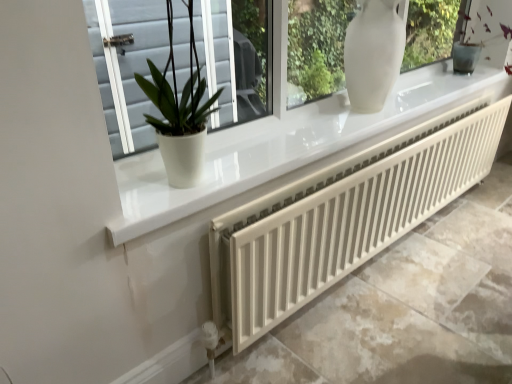
Question: Does white glossy pot at left have a lesser height compared to white matte radiator at lower center?

Choices:
 (A) yes
 (B) no

Answer: (A)

Question: Considering the relative sizes of white glossy pot at left and white matte radiator at lower center in the image provided, is white glossy pot at left thinner than white matte radiator at lower center?

Choices:
 (A) yes
 (B) no

Answer: (B)

Question: Does white glossy pot at left touch white matte radiator at lower center?

Choices:
 (A) no
 (B) yes

Answer: (A)

Question: From the image's perspective, is white glossy pot at left under white matte radiator at lower center?

Choices:
 (A) yes
 (B) no

Answer: (B)

Question: From a real-world perspective, is white glossy pot at left located beneath white matte radiator at lower center?

Choices:
 (A) no
 (B) yes

Answer: (A)

Question: Can you confirm if white glossy pot at left is smaller than white matte radiator at lower center?

Choices:
 (A) no
 (B) yes

Answer: (B)

Question: From the image's perspective, does white matte radiator at lower center appear higher than white glossy pot at left?

Choices:
 (A) yes
 (B) no

Answer: (B)

Question: Can you confirm if white matte radiator at lower center is bigger than white glossy pot at left?

Choices:
 (A) yes
 (B) no

Answer: (A)

Question: From a real-world perspective, is white matte radiator at lower center on top of white glossy pot at left?

Choices:
 (A) no
 (B) yes

Answer: (A)

Question: Is white matte radiator at lower center outside white glossy pot at left?

Choices:
 (A) yes
 (B) no

Answer: (A)

Question: Does white matte radiator at lower center have a smaller size compared to white glossy pot at left?

Choices:
 (A) no
 (B) yes

Answer: (A)

Question: Can you confirm if white matte radiator at lower center is taller than white glossy pot at left?

Choices:
 (A) yes
 (B) no

Answer: (A)

Question: Is white glossy pot at left inside the boundaries of white matte radiator at lower center, or outside?

Choices:
 (A) outside
 (B) inside

Answer: (A)